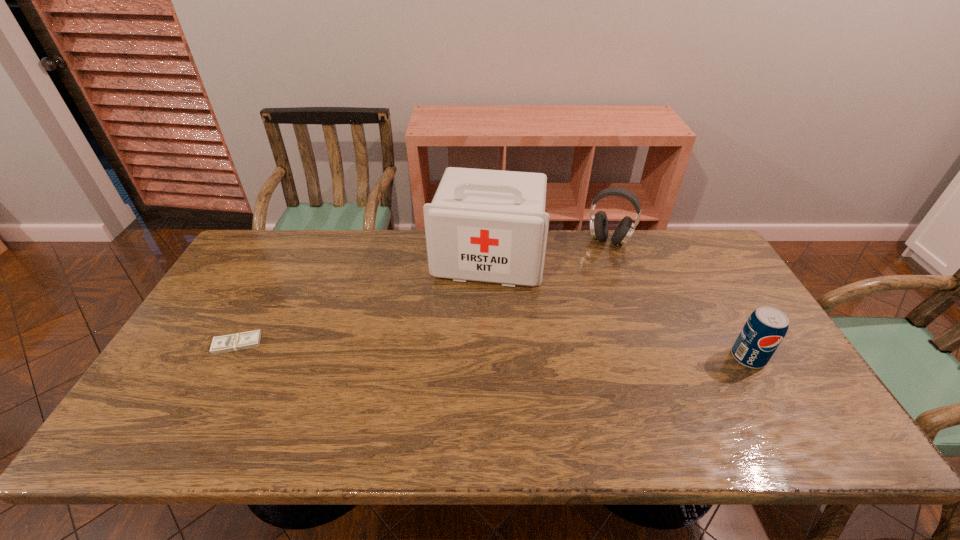
Where is `vacant space situated 0.330m on the front-facing side of the second object from left to right`? The width and height of the screenshot is (960, 540). vacant space situated 0.330m on the front-facing side of the second object from left to right is located at coordinates (461, 379).

What are the coordinates of `free spot located 0.340m on the front-facing side of the second object from left to right` in the screenshot? It's located at (460, 382).

I want to click on vacant space located 0.090m on the front-facing side of the second object from left to right, so click(x=475, y=311).

I want to click on vacant position located 0.060m on the ear cups of the third shortest object, so click(596, 260).

Where is `free location located on the ear cups of the third shortest object`? Image resolution: width=960 pixels, height=540 pixels. free location located on the ear cups of the third shortest object is located at coordinates coord(574,303).

Where is `vacant space situated on the ear cups of the third shortest object`? vacant space situated on the ear cups of the third shortest object is located at coordinates (588, 275).

Where is `the first-aid kit that is positioned at the far edge`? This screenshot has width=960, height=540. the first-aid kit that is positioned at the far edge is located at coordinates (483, 225).

You are a GUI agent. You are given a task and a screenshot of the screen. Output one action in this format:
    pyautogui.click(x=<x>, y=<y>)
    Task: Click on the headset that is at the far edge
    The width and height of the screenshot is (960, 540).
    Given the screenshot: What is the action you would take?
    pyautogui.click(x=599, y=228)

The width and height of the screenshot is (960, 540). I want to click on object located in the left edge section of the desktop, so click(239, 341).

Where is `object located in the right edge section of the desktop`? object located in the right edge section of the desktop is located at coordinates (766, 327).